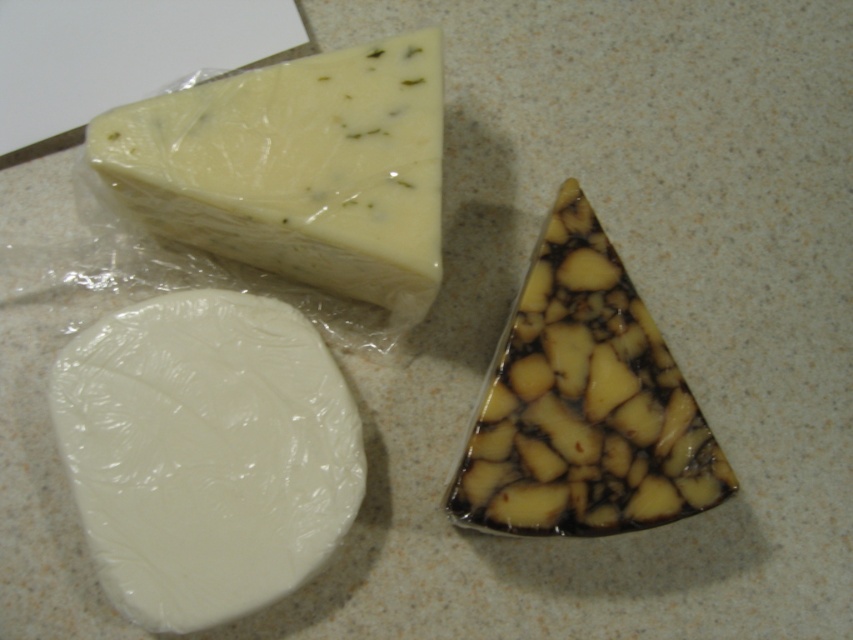
Question: Can you confirm if white matte round cheese at lower left is wider than yellowish-white creamy cheese at upper left?

Choices:
 (A) yes
 (B) no

Answer: (B)

Question: Is yellowish-white creamy cheese at upper left positioned behind brown marbled cheese at center?

Choices:
 (A) no
 (B) yes

Answer: (A)

Question: Which object is closer to the camera taking this photo?

Choices:
 (A) white matte round cheese at lower left
 (B) brown marbled cheese at center

Answer: (A)

Question: Among these objects, which one is nearest to the camera?

Choices:
 (A) white matte round cheese at lower left
 (B) yellowish-white creamy cheese at upper left

Answer: (A)

Question: Which object is closer to the camera taking this photo?

Choices:
 (A) brown marbled cheese at center
 (B) yellowish-white creamy cheese at upper left

Answer: (B)

Question: Does white matte round cheese at lower left appear over yellowish-white creamy cheese at upper left?

Choices:
 (A) no
 (B) yes

Answer: (A)